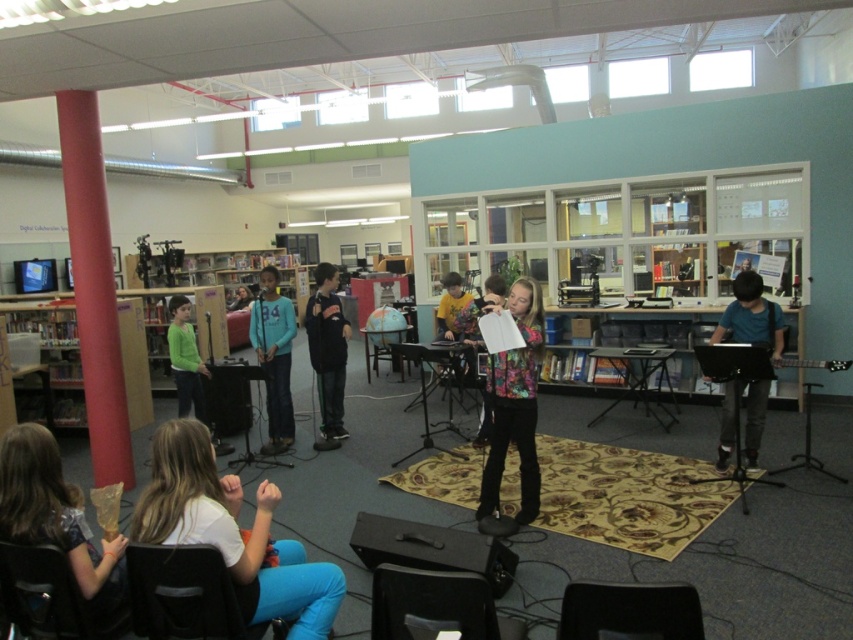
Question: Which point appears closest to the camera in this image?

Choices:
 (A) (331, 314)
 (B) (753, 355)
 (C) (247, 292)

Answer: (B)

Question: Is black matte jacket at center to the left of black electric guitar at right from the viewer's perspective?

Choices:
 (A) no
 (B) yes

Answer: (B)

Question: Which of the following is the farthest from the observer?

Choices:
 (A) (664, 637)
 (B) (537, 362)
 (C) (227, 308)
 (D) (428, 579)

Answer: (C)

Question: Is black plastic chair at lower left below matte blue shirt at center?

Choices:
 (A) no
 (B) yes

Answer: (B)

Question: Which point is closer to the camera?

Choices:
 (A) (700, 365)
 (B) (384, 572)
 (C) (701, 632)

Answer: (C)

Question: Can you confirm if matte black jacket at lower left is positioned above matte blue shirt at center?

Choices:
 (A) yes
 (B) no

Answer: (B)